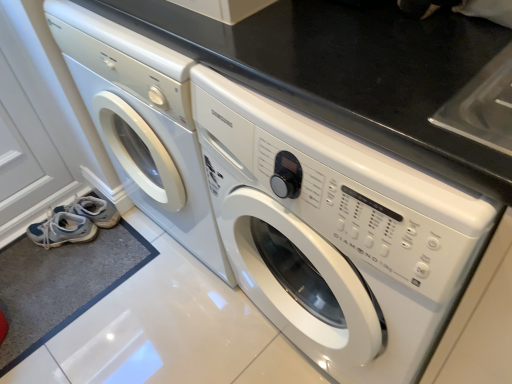
Question: Which direction should I rotate to look at white glossy washing machine at center, which ranks as the first washing machine in left-to-right order, — up or down?

Choices:
 (A) up
 (B) down

Answer: (A)

Question: Is the surface of white glossy washing machine at center, the second washing machine viewed from the right, in direct contact with light blue fabric shoe at lower left, the 2th shoe viewed from the top?

Choices:
 (A) no
 (B) yes

Answer: (A)

Question: Is white glossy washing machine at center, the second washing machine viewed from the right, not near light blue fabric shoe at lower left, the 2th shoe viewed from the top?

Choices:
 (A) yes
 (B) no

Answer: (B)

Question: Does white glossy washing machine at center, which ranks as the first washing machine in left-to-right order, turn towards light blue fabric shoe at lower left, which is the first shoe from bottom to top?

Choices:
 (A) yes
 (B) no

Answer: (A)

Question: Does white glossy washing machine at center, the second washing machine viewed from the right, have a greater height compared to light blue fabric shoe at lower left, the 2th shoe viewed from the top?

Choices:
 (A) yes
 (B) no

Answer: (A)

Question: Is light blue fabric shoe at lower left, which is the first shoe from bottom to top, at the back of white glossy washing machine at center, the second washing machine viewed from the right?

Choices:
 (A) no
 (B) yes

Answer: (A)

Question: From the image's perspective, does white glossy washing machine at center, the second washing machine viewed from the right, appear higher than light blue fabric shoe at lower left, the 2th shoe viewed from the top?

Choices:
 (A) no
 (B) yes

Answer: (B)

Question: From a real-world perspective, is white glossy washing machine at center, acting as the 2th washing machine starting from the left, beneath light blue fabric shoe at lower left, the 2th shoe viewed from the top?

Choices:
 (A) no
 (B) yes

Answer: (A)

Question: Can you confirm if white glossy washing machine at center, the 1th washing machine positioned from the right, is smaller than light blue fabric shoe at lower left, the 2th shoe viewed from the top?

Choices:
 (A) yes
 (B) no

Answer: (B)

Question: Is white glossy washing machine at center, the 1th washing machine positioned from the right, shorter than light blue fabric shoe at lower left, which is the first shoe from bottom to top?

Choices:
 (A) yes
 (B) no

Answer: (B)

Question: Can you confirm if white glossy washing machine at center, acting as the 2th washing machine starting from the left, is taller than light blue fabric shoe at lower left, which is the first shoe from bottom to top?

Choices:
 (A) no
 (B) yes

Answer: (B)

Question: Is white glossy washing machine at center, acting as the 2th washing machine starting from the left, completely or partially outside of light blue fabric shoe at lower left, which is the first shoe from bottom to top?

Choices:
 (A) no
 (B) yes

Answer: (B)

Question: Does white glossy washing machine at center, the 1th washing machine positioned from the right, turn towards light blue fabric shoe at lower left, which is the first shoe from bottom to top?

Choices:
 (A) no
 (B) yes

Answer: (A)

Question: Is light blue fabric shoe at lower left, the 2th shoe viewed from the top, to the right of white fabric shoe at lower left, which is the 2th shoe in bottom-to-top order, from the viewer's perspective?

Choices:
 (A) no
 (B) yes

Answer: (A)